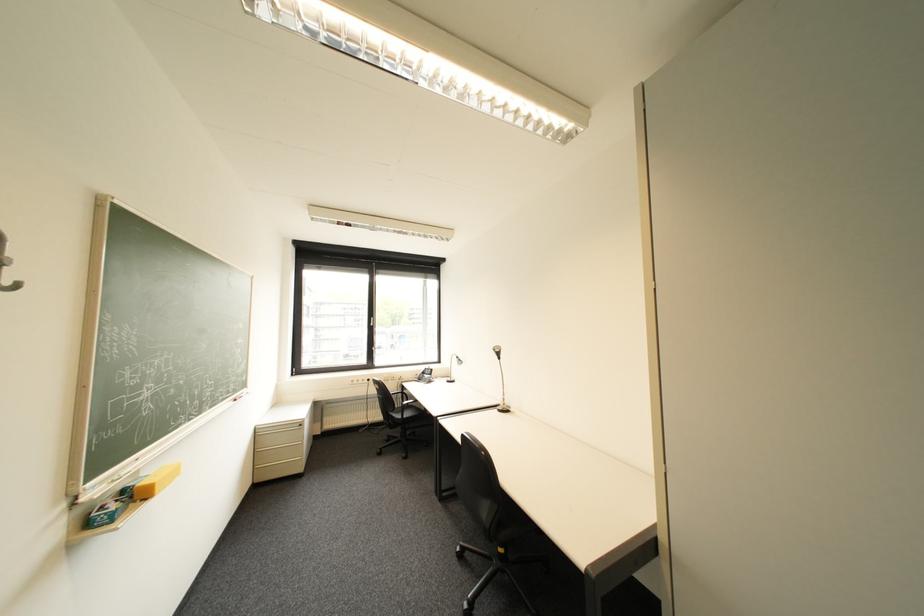
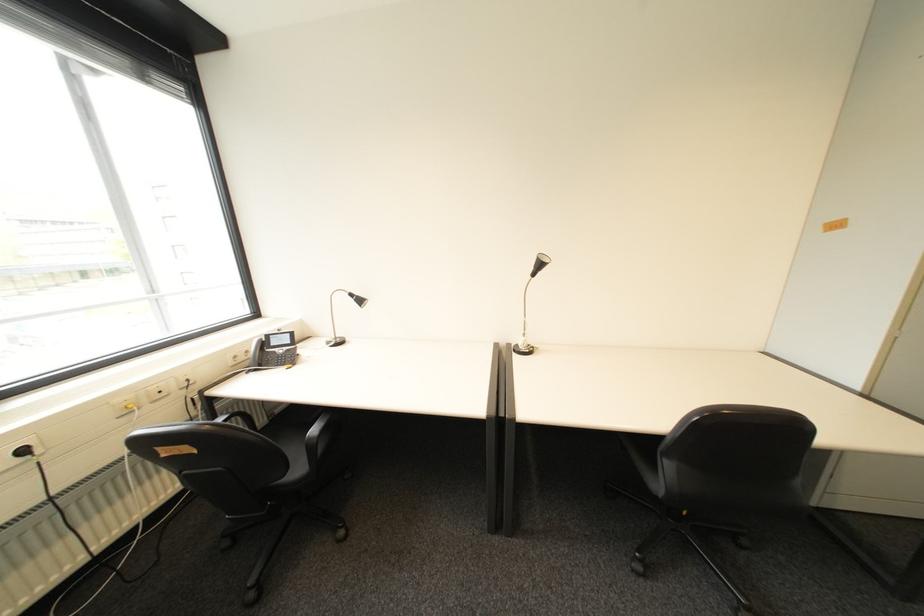
Locate, in the second image, the point that corresponds to (379,381) in the first image.

(34, 452)